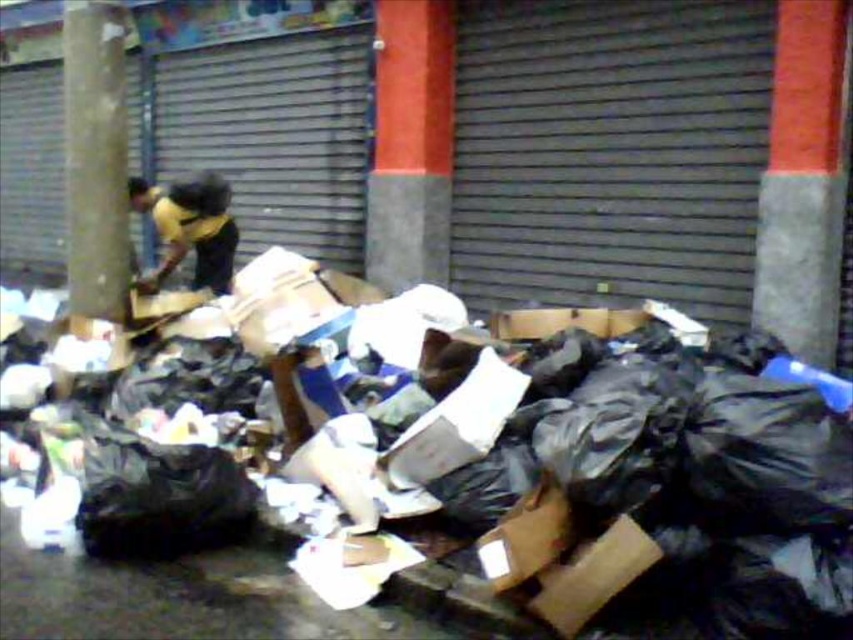
Question: Does red concrete pillar at center have a larger size compared to yellow jersey at center?

Choices:
 (A) no
 (B) yes

Answer: (B)

Question: Which object is farther from the camera taking this photo?

Choices:
 (A) red concrete pillar at center right
 (B) black plastic bags at center
 (C) smooth concrete pillar at left

Answer: (C)

Question: Which point appears farthest from the camera in this image?

Choices:
 (A) (836, 196)
 (B) (633, 460)
 (C) (209, 205)

Answer: (C)

Question: Is red concrete pillar at center further to the viewer compared to yellow jersey at center?

Choices:
 (A) no
 (B) yes

Answer: (B)

Question: Is black plastic bags at center further to camera compared to yellow jersey at center?

Choices:
 (A) no
 (B) yes

Answer: (A)

Question: Which of the following is the closest to the observer?

Choices:
 (A) (485, 468)
 (B) (428, 192)

Answer: (A)